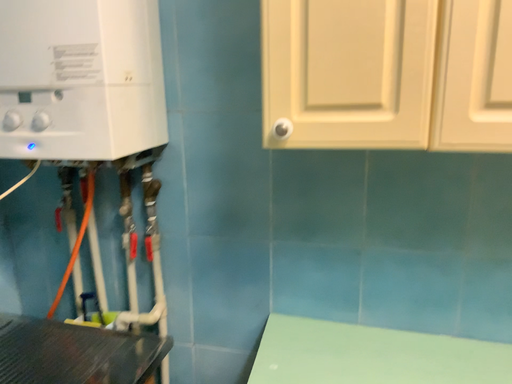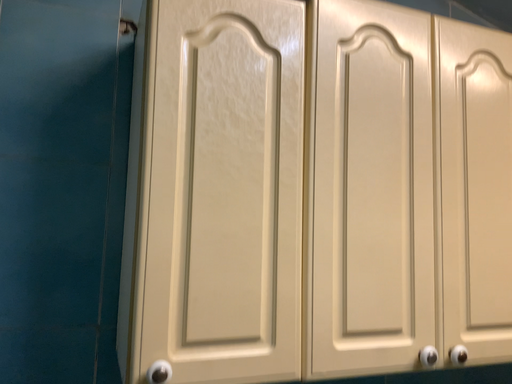
Question: Which way did the camera rotate in the video?

Choices:
 (A) rotated right
 (B) rotated left

Answer: (A)